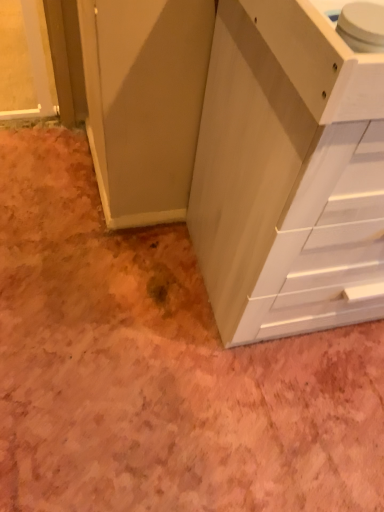
The image size is (384, 512). Identify the location of white wood chest of drawers at lower right. (288, 174).

Describe the element at coordinates (288, 174) in the screenshot. I see `white wood chest of drawers at lower right` at that location.

At what (x,y) coordinates should I click in order to perform the action: click on white wood chest of drawers at lower right. Please return your answer as a coordinate pair (x, y). This screenshot has height=512, width=384. Looking at the image, I should click on (288, 174).